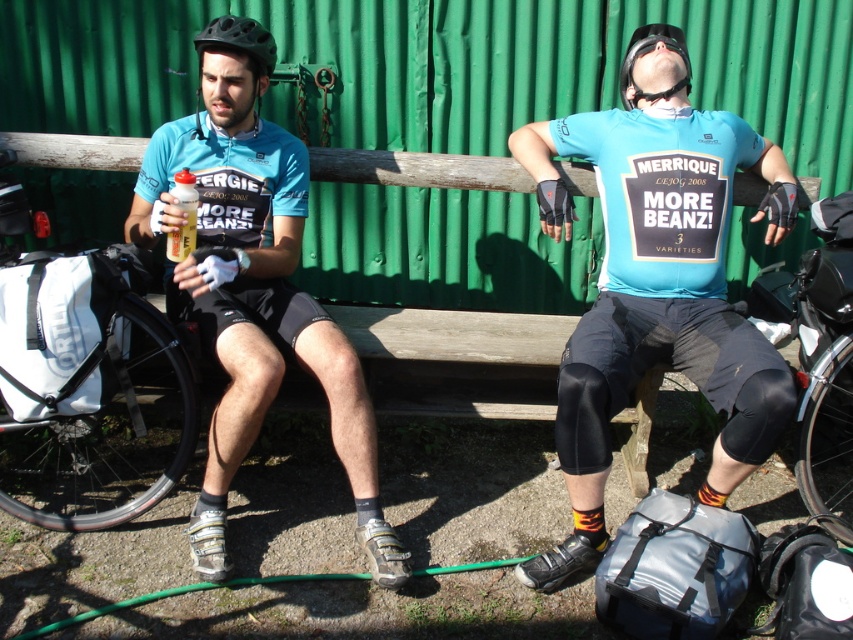
Between point (758, 376) and point (219, 38), which one is positioned in front?

Point (758, 376)

Does matte blue jersey at center have a lesser width compared to black matte helmet at upper left?

Incorrect, matte blue jersey at center's width is not less than black matte helmet at upper left's.

The height and width of the screenshot is (640, 853). I want to click on matte blue jersey at center, so click(657, 296).

Between point (57, 292) and point (271, 36), which one is positioned in front?

Point (57, 292) is more forward.

Is point (33, 324) farther from camera compared to point (225, 20)?

No, it is not.

Find the location of a particular element. This screenshot has height=640, width=853. white fabric bag at left is located at coordinates (88, 388).

Is matte blue jersey at center to the right of white fabric bag at left from the viewer's perspective?

Yes, matte blue jersey at center is to the right of white fabric bag at left.

Who is positioned more to the right, matte blue jersey at center or white fabric bag at left?

From the viewer's perspective, matte blue jersey at center appears more on the right side.

Is point (676, 140) in front of point (128, 419)?

Yes, point (676, 140) is in front of point (128, 419).

Image resolution: width=853 pixels, height=640 pixels. I want to click on matte blue jersey at center, so click(x=657, y=296).